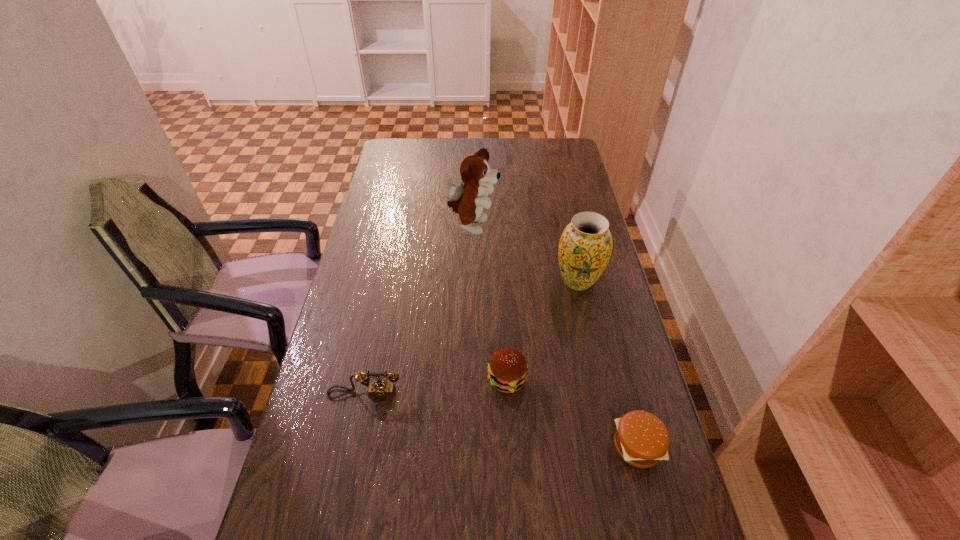
Image resolution: width=960 pixels, height=540 pixels. In order to click on unoccupied area between the nearest object and the farther hamburger in this screenshot , I will do `click(572, 413)`.

Locate an element on the screen. The width and height of the screenshot is (960, 540). free area in between the fourth nearest object and the farthest object is located at coordinates (525, 254).

Point out which object is positioned as the nearest to the left hamburger. Please provide its 2D coordinates. Your answer should be formatted as a tuple, i.e. [(x, y)], where the tuple contains the x and y coordinates of a point satisfying the conditions above.

[(641, 439)]

Choose which object is the fourth nearest neighbor to the telephone. Please provide its 2D coordinates. Your answer should be formatted as a tuple, i.e. [(x, y)], where the tuple contains the x and y coordinates of a point satisfying the conditions above.

[(468, 200)]

You are a GUI agent. You are given a task and a screenshot of the screen. Output one action in this format:
    pyautogui.click(x=<x>, y=<y>)
    Task: Click on the vacant area in the image that satisfies the following two spatial constraints: 1. on the front side of the left hamburger; 2. on the left side of the right hamburger
    The height and width of the screenshot is (540, 960).
    Given the screenshot: What is the action you would take?
    pyautogui.click(x=511, y=446)

You are a GUI agent. You are given a task and a screenshot of the screen. Output one action in this format:
    pyautogui.click(x=<x>, y=<y>)
    Task: Click on the free spot that satisfies the following two spatial constraints: 1. on the front-facing side of the leftmost object; 2. on the right side of the right hamburger
    This screenshot has width=960, height=540.
    Given the screenshot: What is the action you would take?
    pyautogui.click(x=353, y=446)

The height and width of the screenshot is (540, 960). I want to click on free spot that satisfies the following two spatial constraints: 1. on the face of the farthest object; 2. on the left side of the second tallest object, so click(471, 281).

Image resolution: width=960 pixels, height=540 pixels. Find the location of `vacant position in the image that satisfies the following two spatial constraints: 1. on the face of the second tallest object; 2. on the left side of the farthest object`. vacant position in the image that satisfies the following two spatial constraints: 1. on the face of the second tallest object; 2. on the left side of the farthest object is located at coordinates (471, 281).

The image size is (960, 540). What are the coordinates of `vacant space that satisfies the following two spatial constraints: 1. on the front-facing side of the leftmost object; 2. on the right side of the shorter hamburger` in the screenshot? It's located at (353, 446).

At what (x,y) coordinates should I click in order to perform the action: click on free location that satisfies the following two spatial constraints: 1. on the back side of the right hamburger; 2. on the face of the farthest object. Please return your answer as a coordinate pair (x, y). This screenshot has width=960, height=540. Looking at the image, I should click on click(x=581, y=227).